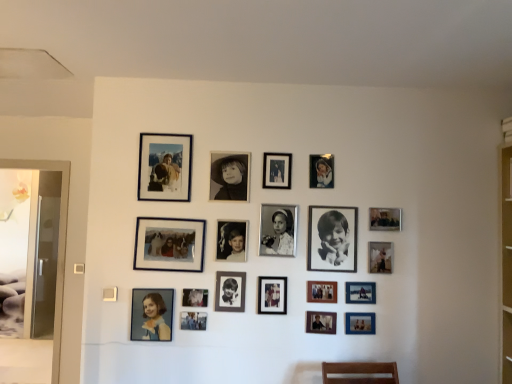
Question: Is metallic silver photo frame at center-right, the 17th picture frame positioned from the left, with metallic silver photo frame at lower center, the seventh picture frame when ordered from right to left?

Choices:
 (A) no
 (B) yes

Answer: (A)

Question: Is metallic silver photo frame at center-right, the 17th picture frame positioned from the left, smaller than metallic silver photo frame at lower center, which is counted as the 12th picture frame, starting from the left?

Choices:
 (A) no
 (B) yes

Answer: (B)

Question: Is metallic silver photo frame at center-right, positioned as the 2th picture frame in right-to-left order, closer to the viewer compared to metallic silver photo frame at lower center, which is counted as the 12th picture frame, starting from the left?

Choices:
 (A) yes
 (B) no

Answer: (B)

Question: Could you tell me if metallic silver photo frame at center-right, positioned as the 2th picture frame in right-to-left order, is facing metallic silver photo frame at lower center, the seventh picture frame when ordered from right to left?

Choices:
 (A) yes
 (B) no

Answer: (B)

Question: Is metallic silver photo frame at center-right, the 17th picture frame positioned from the left, to the left of metallic silver photo frame at lower center, which is counted as the 12th picture frame, starting from the left, from the viewer's perspective?

Choices:
 (A) no
 (B) yes

Answer: (A)

Question: Considering their positions, is matte black photo frame at center, placed as the 10th picture frame when sorted from right to left, located in front of or behind matte blue photo frame at lower right, positioned as the 3th picture frame in right-to-left order?

Choices:
 (A) behind
 (B) front

Answer: (B)

Question: Is matte black photo frame at center, the 9th picture frame in the left-to-right sequence, spatially inside matte blue photo frame at lower right, positioned as the sixteenth picture frame in left-to-right order, or outside of it?

Choices:
 (A) outside
 (B) inside

Answer: (A)

Question: Considering the relative positions of matte black photo frame at center, the 9th picture frame in the left-to-right sequence, and matte blue photo frame at lower right, positioned as the sixteenth picture frame in left-to-right order, in the image provided, is matte black photo frame at center, the 9th picture frame in the left-to-right sequence, to the left or to the right of matte blue photo frame at lower right, positioned as the sixteenth picture frame in left-to-right order,?

Choices:
 (A) right
 (B) left

Answer: (B)

Question: From a real-world perspective, is matte black photo frame at center, placed as the 10th picture frame when sorted from right to left, positioned above or below matte blue photo frame at lower right, positioned as the 3th picture frame in right-to-left order?

Choices:
 (A) below
 (B) above

Answer: (B)

Question: Considering the positions of matte black photo frame at center, which appears as the 16th picture frame when viewed from the right, and black matte portrait at center, the 4th picture frame in the right-to-left sequence, in the image, is matte black photo frame at center, which appears as the 16th picture frame when viewed from the right, taller or shorter than black matte portrait at center, the 4th picture frame in the right-to-left sequence,?

Choices:
 (A) tall
 (B) short

Answer: (B)

Question: Considering the relative positions of matte black photo frame at center, which is the 3th picture frame in left-to-right order, and black matte portrait at center, the 4th picture frame in the right-to-left sequence, in the image provided, is matte black photo frame at center, which is the 3th picture frame in left-to-right order, to the left or to the right of black matte portrait at center, the 4th picture frame in the right-to-left sequence,?

Choices:
 (A) left
 (B) right

Answer: (A)

Question: In terms of width, does matte black photo frame at center, which appears as the 16th picture frame when viewed from the right, look wider or thinner when compared to black matte portrait at center, which is the fifteenth picture frame in left-to-right order?

Choices:
 (A) thin
 (B) wide

Answer: (A)

Question: From the image's perspective, is matte black photo frame at center, which is the 3th picture frame in left-to-right order, located above or below black matte portrait at center, which is the fifteenth picture frame in left-to-right order?

Choices:
 (A) below
 (B) above

Answer: (A)

Question: Based on their positions, is black matte photo frame at center, marked as the thirteenth picture frame in a right-to-left arrangement, located to the left or right of metallic silver photo frame at lower center, which appears as the fourth picture frame when viewed from the left?

Choices:
 (A) left
 (B) right

Answer: (B)

Question: In the image, is black matte photo frame at center, the 6th picture frame viewed from the left, positioned in front of or behind metallic silver photo frame at lower center, which appears as the fourth picture frame when viewed from the left?

Choices:
 (A) front
 (B) behind

Answer: (B)